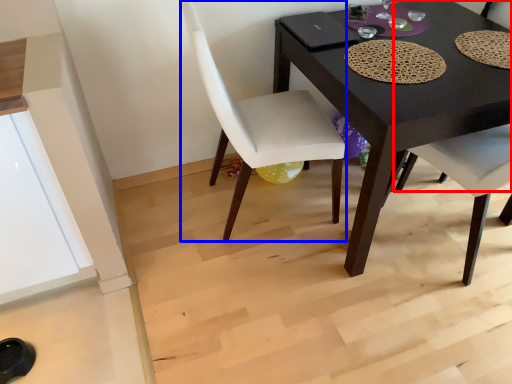
Question: Among these objects, which one is farthest to the camera, chair (highlighted by a red box) or chair (highlighted by a blue box)?

Choices:
 (A) chair
 (B) chair

Answer: (A)